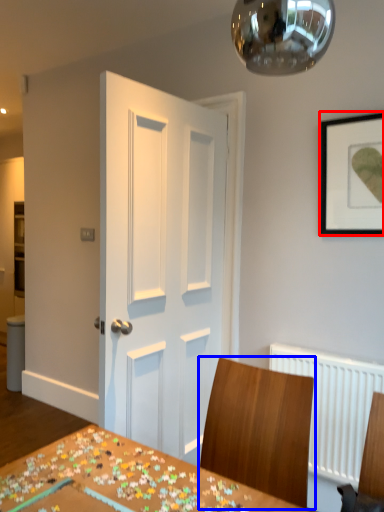
Question: Among these objects, which one is farthest to the camera, picture frame (highlighted by a red box) or chair (highlighted by a blue box)?

Choices:
 (A) picture frame
 (B) chair

Answer: (A)